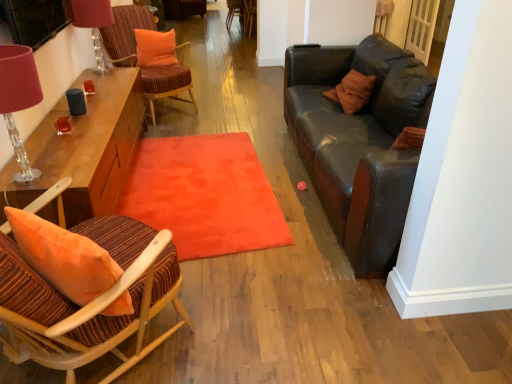
The width and height of the screenshot is (512, 384). Find the location of `empty space that is ontop of velvet orange rug at center (from a real-world perspective)`. empty space that is ontop of velvet orange rug at center (from a real-world perspective) is located at coordinates (195, 178).